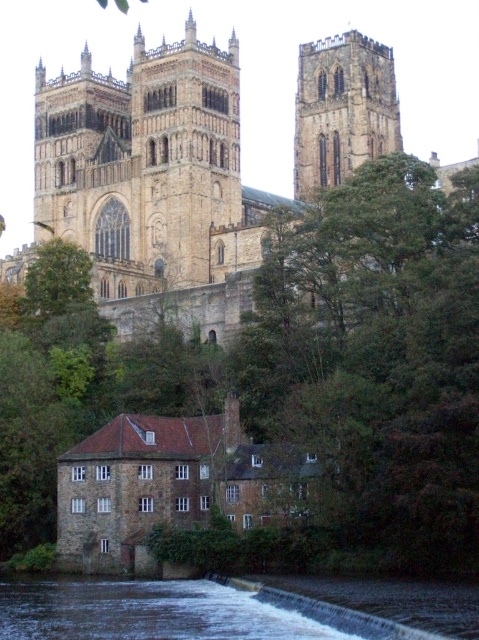
Is point (253, 428) positioned after point (129, 280)?

No, it is not.

Based on the photo, can you confirm if green leafy tree at center is taller than brown stone church at upper center?

No, green leafy tree at center is not taller than brown stone church at upper center.

Is point (410, 230) behind point (192, 84)?

No, it is not.

This screenshot has height=640, width=479. I want to click on green leafy tree at center, so click(x=376, y=362).

Is dark gray concrete river at lower center positioned before brown stone tower at upper center?

That is True.

From the picture: Is dark gray concrete river at lower center bigger than brown stone tower at upper center?

Actually, dark gray concrete river at lower center might be smaller than brown stone tower at upper center.

Between point (340, 604) and point (395, 108), which one is positioned behind?

The point (395, 108) is more distant.

This screenshot has width=479, height=640. Identify the location of dark gray concrete river at lower center. (145, 611).

Which is behind, point (394, 376) or point (162, 595)?

The point (394, 376) is behind.

Who is positioned more to the right, green leafy tree at center or dark gray concrete river at lower center?

green leafy tree at center is more to the right.

I want to click on green leafy tree at center, so click(376, 362).